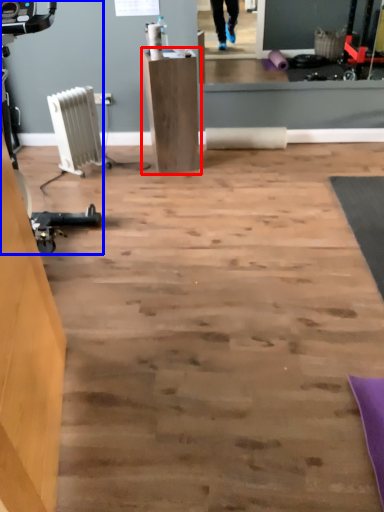
Question: Which object appears farthest to the camera in this image, furniture (highlighted by a red box) or sport equipment (highlighted by a blue box)?

Choices:
 (A) furniture
 (B) sport equipment

Answer: (A)